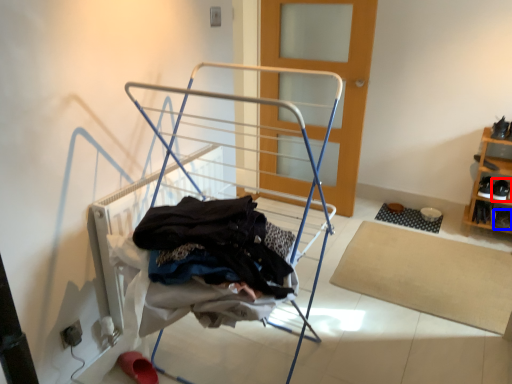
Question: Which point is further to the camera, footwear (highlighted by a red box) or shoe (highlighted by a blue box)?

Choices:
 (A) footwear
 (B) shoe

Answer: (B)